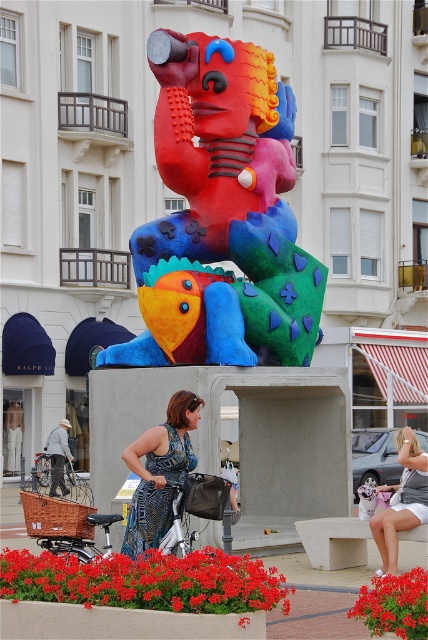
Question: Can you confirm if matte plastic sculpture at center is positioned above vivid red petals at center?

Choices:
 (A) yes
 (B) no

Answer: (A)

Question: Estimate the real-world distances between objects in this image. Which object is closer to the vibrant red petals at center?

Choices:
 (A) blue textured dress at center
 (B) vivid red petals at center
 (C) white cotton shorts at lower right

Answer: (B)

Question: Does blue textured dress at center have a lesser width compared to white cotton shorts at lower right?

Choices:
 (A) yes
 (B) no

Answer: (B)

Question: Can you confirm if matte plastic sculpture at center is bigger than white cotton shorts at lower right?

Choices:
 (A) no
 (B) yes

Answer: (B)

Question: Which object appears farthest from the camera in this image?

Choices:
 (A) blue textured dress at center
 (B) matte plastic sculpture at center

Answer: (B)

Question: Which point appears closest to the camera in this image?

Choices:
 (A) (118, 577)
 (B) (142, 285)
 (C) (403, 504)
 (D) (377, 593)

Answer: (D)